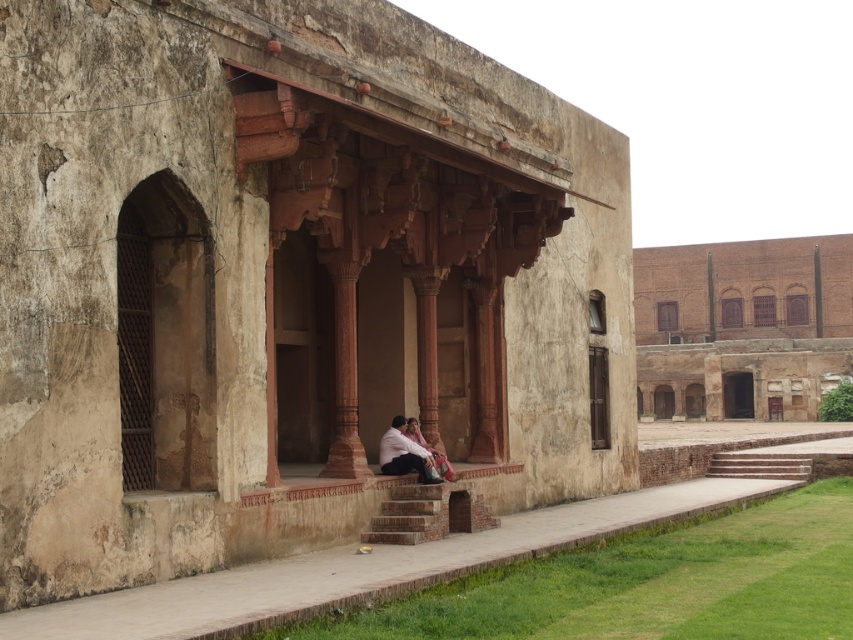
Question: Does brown brick building at center appear on the right side of brown stone stairs at center?

Choices:
 (A) no
 (B) yes

Answer: (B)

Question: Estimate the real-world distances between objects in this image. Which object is farther from the brown brick building at center?

Choices:
 (A) brown stone stairs at center
 (B) brown stone palace at center
 (C) matte pink fabric at center

Answer: (C)

Question: Among these objects, which one is farthest from the camera?

Choices:
 (A) brown brick building at center
 (B) brown stone palace at center
 (C) matte pink fabric at center
 (D) brown stone stairs at center

Answer: (A)

Question: Which point is farther from the camera taking this photo?

Choices:
 (A) (643, 252)
 (B) (158, 513)
 (C) (387, 525)

Answer: (A)

Question: Does brown brick building at center have a larger size compared to brown stone stairs at center?

Choices:
 (A) no
 (B) yes

Answer: (B)

Question: Can you confirm if brown stone stairs at center is wider than matte pink fabric at center?

Choices:
 (A) yes
 (B) no

Answer: (A)